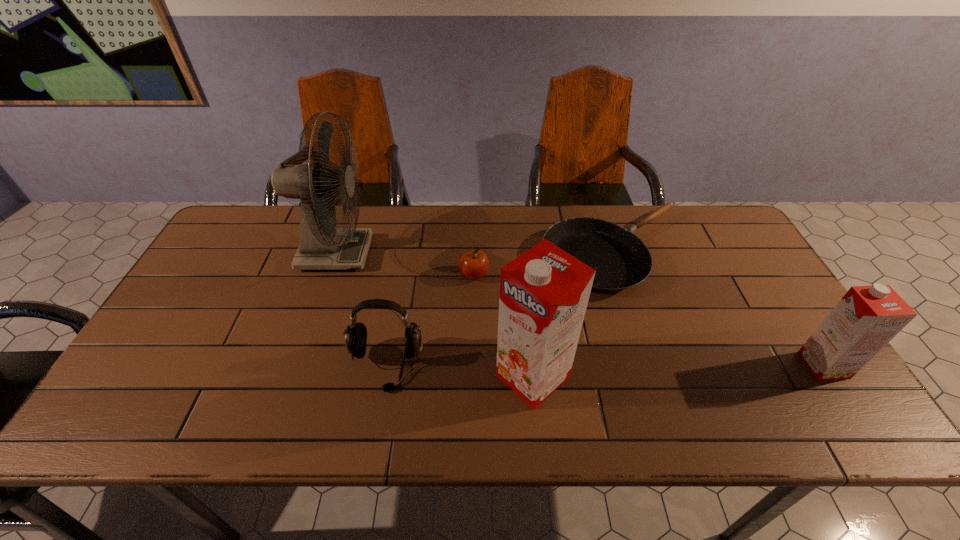
Locate an element on the screen. This screenshot has width=960, height=540. the left carton is located at coordinates (544, 292).

What are the coordinates of `the taller carton` in the screenshot? It's located at (544, 292).

Where is `the right carton`? The image size is (960, 540). the right carton is located at coordinates (867, 318).

You are a GUI agent. You are given a task and a screenshot of the screen. Output one action in this format:
    pyautogui.click(x=<x>, y=<y>)
    Task: Click on the shorter carton
    The image size is (960, 540).
    Given the screenshot: What is the action you would take?
    [x=867, y=318]

The height and width of the screenshot is (540, 960). What are the coordinates of `the shortest object` in the screenshot? It's located at (621, 260).

Identify the location of the fourth object from right to left. This screenshot has width=960, height=540. (473, 264).

You are a GUI agent. You are given a task and a screenshot of the screen. Output one action in this format:
    pyautogui.click(x=<x>, y=<y>)
    Task: Click on the fifth tallest object
    This screenshot has height=540, width=960.
    Given the screenshot: What is the action you would take?
    pyautogui.click(x=473, y=264)

Image resolution: width=960 pixels, height=540 pixels. What are the coordinates of `the leftmost object` in the screenshot? It's located at (322, 246).

Find the location of a particular element. This screenshot has width=960, height=540. the third shortest object is located at coordinates (356, 334).

The width and height of the screenshot is (960, 540). I want to click on headset, so click(356, 334).